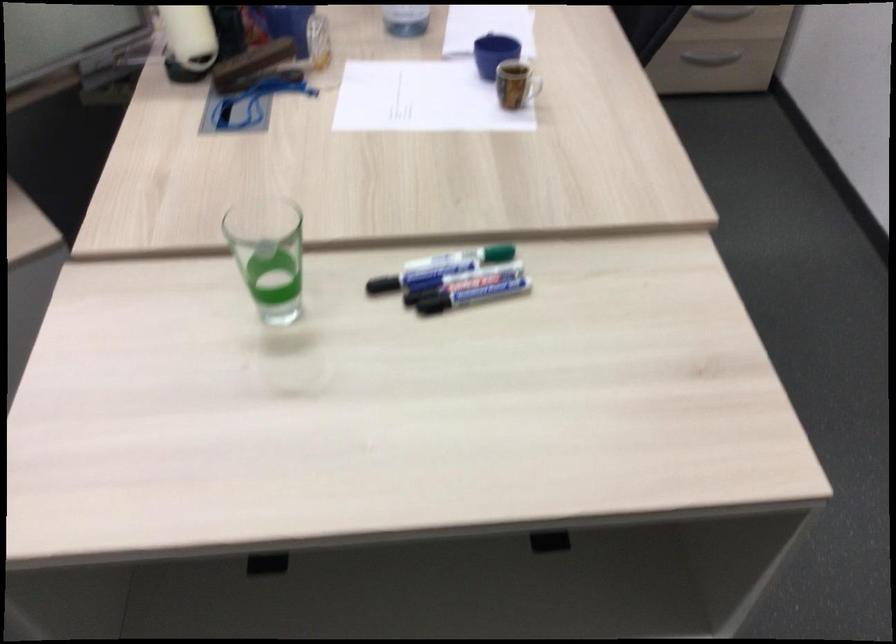
Which object does [494,53] point to?

It corresponds to the small blue bowl in the image.